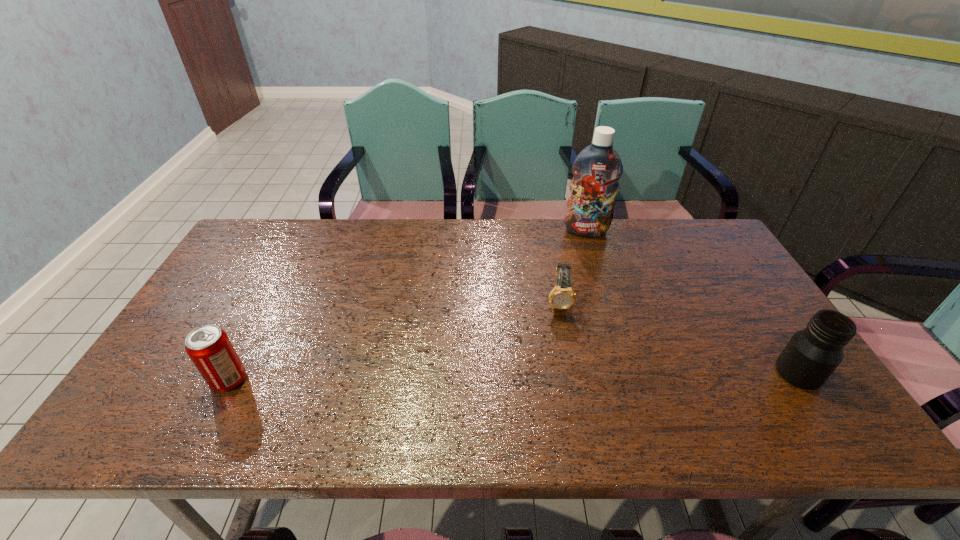
Identify the location of free space located on the face of the watch. Image resolution: width=960 pixels, height=540 pixels. (562, 357).

Identify the location of vacant region located on the face of the watch. (562, 361).

Where is `free space located 0.180m on the front label of the shampoo`? The image size is (960, 540). free space located 0.180m on the front label of the shampoo is located at coordinates (588, 273).

Image resolution: width=960 pixels, height=540 pixels. I want to click on free space located 0.330m on the front label of the shampoo, so click(591, 307).

Find the location of a particular element. The width and height of the screenshot is (960, 540). blank space located 0.280m on the front label of the shampoo is located at coordinates (590, 295).

At what (x,y) coordinates should I click in order to perform the action: click on object that is at the far edge. Please return your answer as a coordinate pair (x, y). This screenshot has height=540, width=960. Looking at the image, I should click on (597, 169).

Locate an element on the screen. This screenshot has width=960, height=540. soda can that is at the near edge is located at coordinates (209, 348).

Locate an element on the screen. This screenshot has height=540, width=960. jar present at the near edge is located at coordinates (812, 354).

I want to click on object that is at the left edge, so click(x=209, y=348).

This screenshot has width=960, height=540. What are the coordinates of `object that is at the right edge` in the screenshot? It's located at (812, 354).